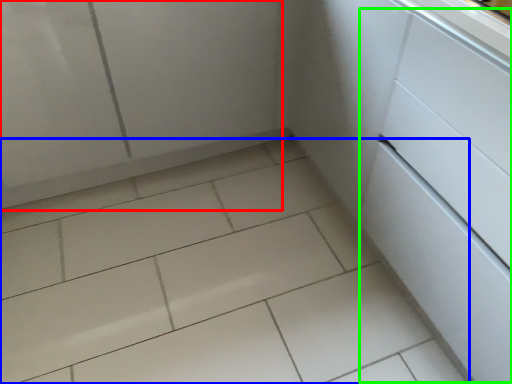
Question: Estimate the real-world distances between objects in this image. Which object is closer to screen door (highlighted by a red box), ceramic tile (highlighted by a blue box) or drawer (highlighted by a green box)?

Choices:
 (A) ceramic tile
 (B) drawer

Answer: (A)